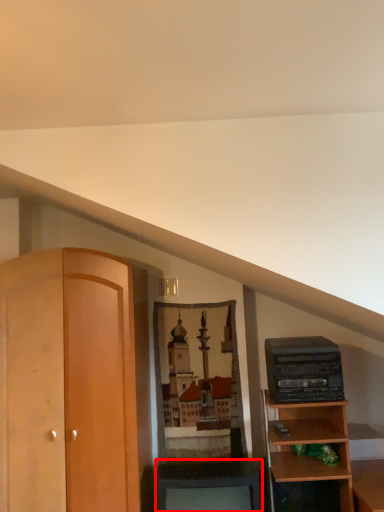
Question: Considering the relative positions of cabinetry (annotated by the red box) and stereo in the image provided, where is cabinetry (annotated by the red box) located with respect to the staircase?

Choices:
 (A) right
 (B) left

Answer: (B)